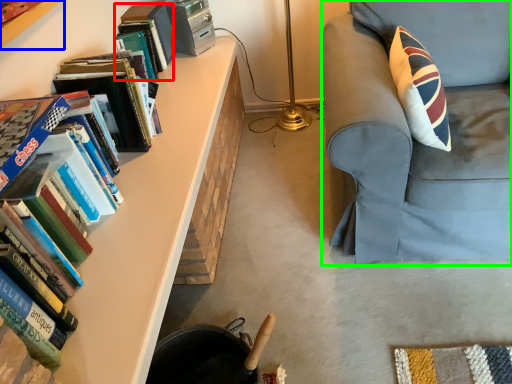
Question: Which is nearer to the book (highlighted by a red box)? bookcase (highlighted by a blue box) or chair (highlighted by a green box).

Choices:
 (A) bookcase
 (B) chair

Answer: (A)